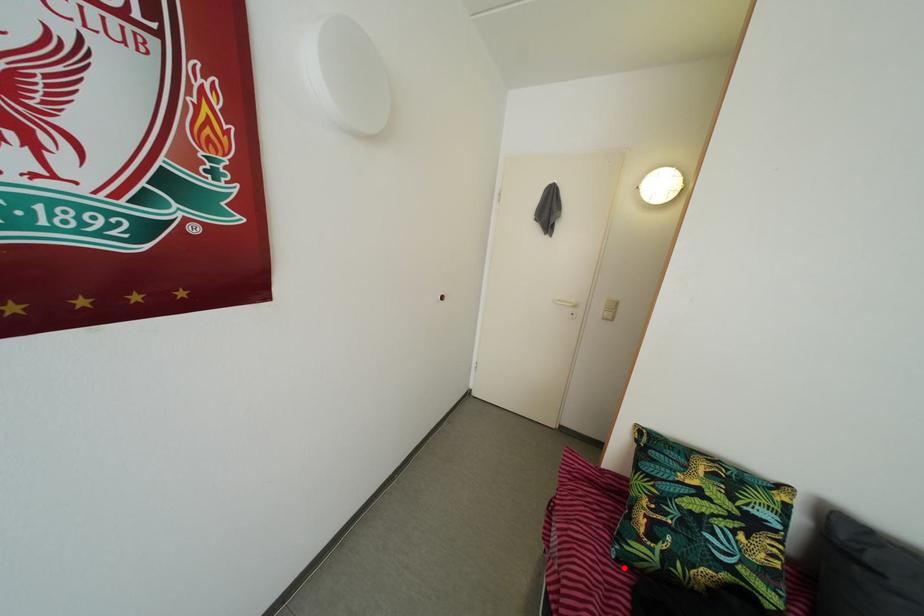
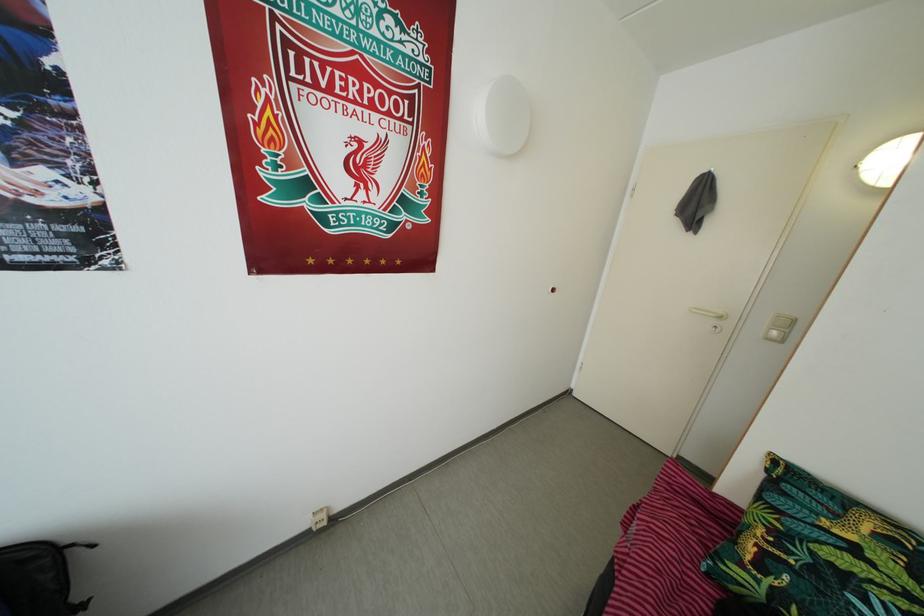
Question: I am providing you with two images of the same scene from different viewpoints. Image1 has a red point marked. In image2, the corresponding 3D location appears at what relative position? Reply with the corresponding letter.

Choices:
 (A) Closer
 (B) Farther

Answer: (B)